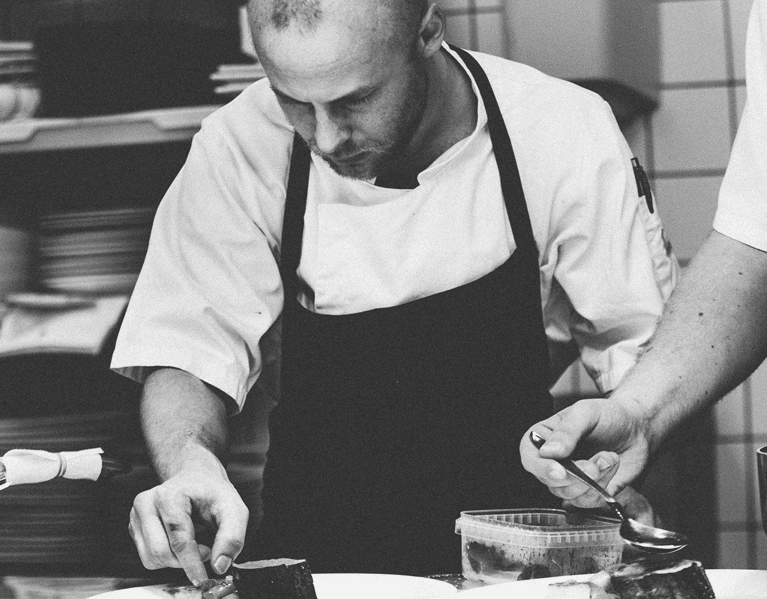
This screenshot has height=599, width=767. Find the location of `shelves`. shelves is located at coordinates (97, 125), (80, 331).